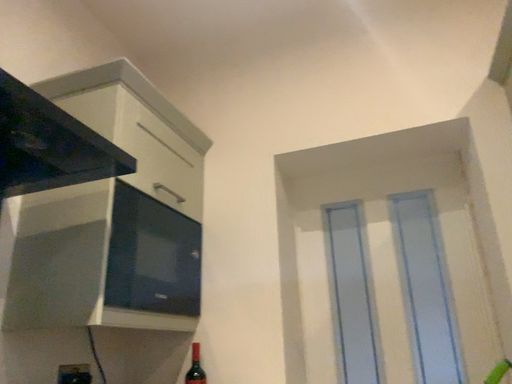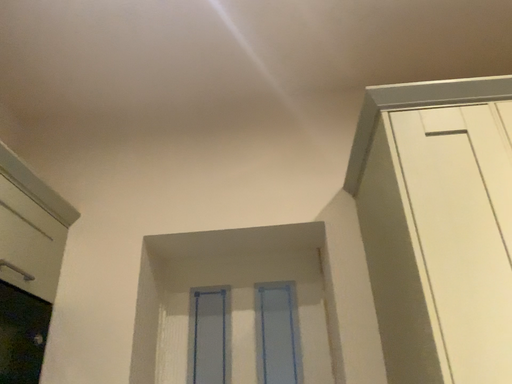
Question: How did the camera likely rotate when shooting the video?

Choices:
 (A) rotated right
 (B) rotated left

Answer: (A)